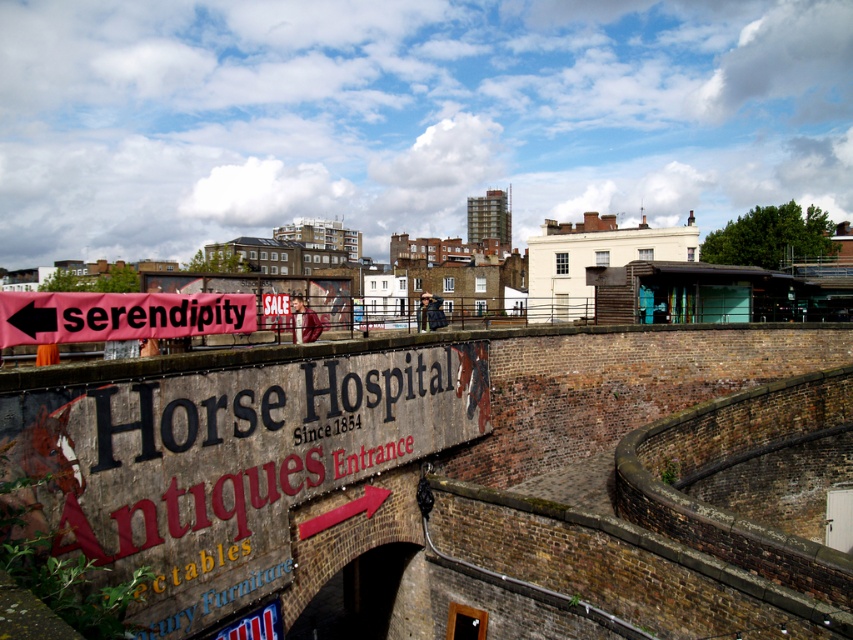
You are standing in front of the brick wall at center and the pink fabric banner at left. Which object is taller?

The brick wall at center is much taller than the pink fabric banner at left.